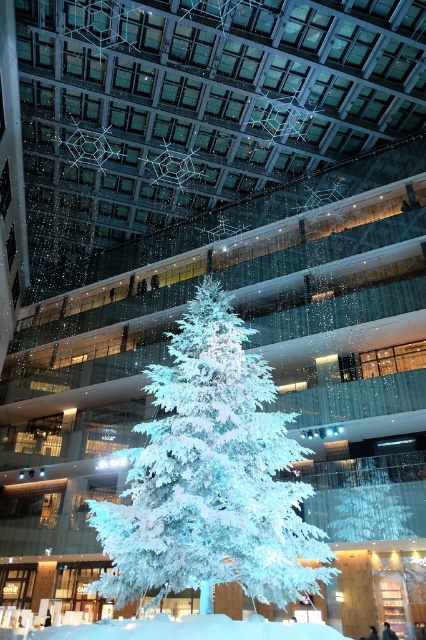
You are standing in the atrium of the mall and want to take a photo of both the Christmas tree and the snowflake lights. You notice two points marked in the scene. One is at coordinates point (189,392) and the other is point (131,624). Which point should you stand closer to in order to capture both the tree and the snowflake lights in your frame?

You should stand closer to point (189,392) because it is closer to the viewer than point (131,624), allowing you to include both the Christmas tree and the snowflake lights in your photo.

You are standing in the center of the atrium and want to take a photo of the white frosty tree at center. If you look at the coordinates on your camera screen, where should you aim your camera to capture the tree perfectly?

You should aim your camera at point (210, 476) to capture the white frosty tree at center perfectly.